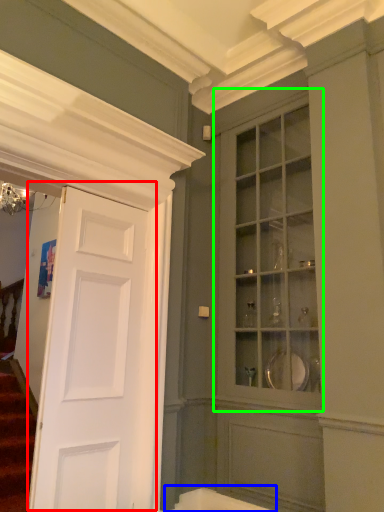
Question: Which object is the farthest from door (highlighted by a red box)? Choose among these: bath (highlighted by a blue box) or cabinetry (highlighted by a green box).

Choices:
 (A) bath
 (B) cabinetry

Answer: (B)